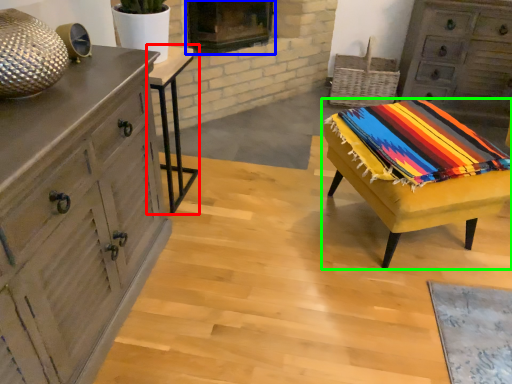
Question: Which object is the farthest from table (highlighted by a red box)? Choose among these: fireplace (highlighted by a blue box) or table (highlighted by a green box).

Choices:
 (A) fireplace
 (B) table

Answer: (B)